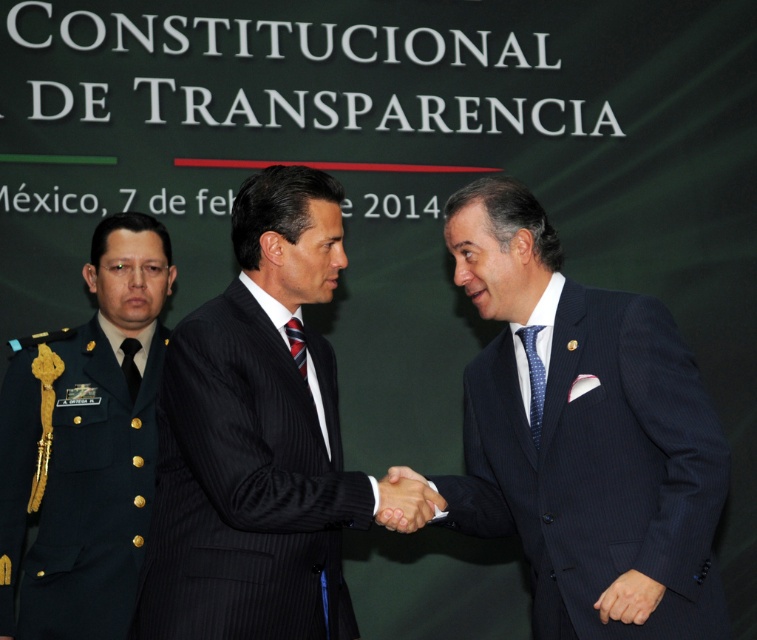
Is green military uniform at left wider than striped fabric tie at center?

Yes, green military uniform at left is wider than striped fabric tie at center.

Is green military uniform at left bigger than striped fabric tie at center?

Yes, green military uniform at left is bigger than striped fabric tie at center.

In the scene shown: Who is more distant from viewer, (73, 636) or (290, 340)?

Positioned behind is point (73, 636).

Image resolution: width=757 pixels, height=640 pixels. I want to click on green military uniform at left, so click(x=86, y=448).

Who is positioned more to the left, green military uniform at left or black silk tie at center?

green military uniform at left

Which is below, green military uniform at left or black silk tie at center?

Positioned lower is green military uniform at left.

Is point (162, 244) in front of point (129, 362)?

No, it is behind (129, 362).

The height and width of the screenshot is (640, 757). In order to click on green military uniform at left in this screenshot , I will do `click(86, 448)`.

Is dark blue pinstripe suit at center closer to the viewer compared to black pinstripe suit at center?

No.

Who is taller, dark blue pinstripe suit at center or black pinstripe suit at center?

dark blue pinstripe suit at center

Is point (646, 483) more distant than point (279, 433)?

That is True.

Where is `dark blue pinstripe suit at center`? This screenshot has width=757, height=640. dark blue pinstripe suit at center is located at coordinates (584, 436).